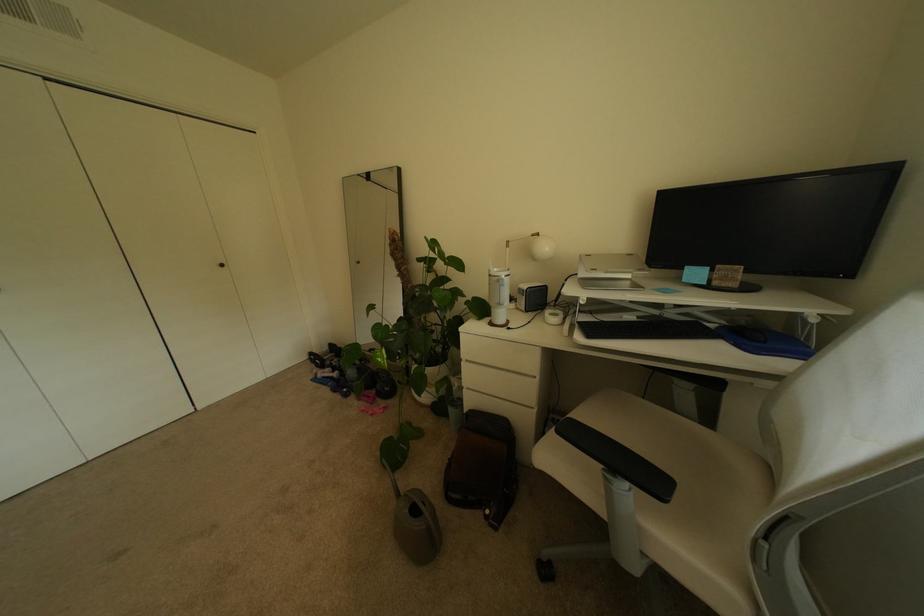
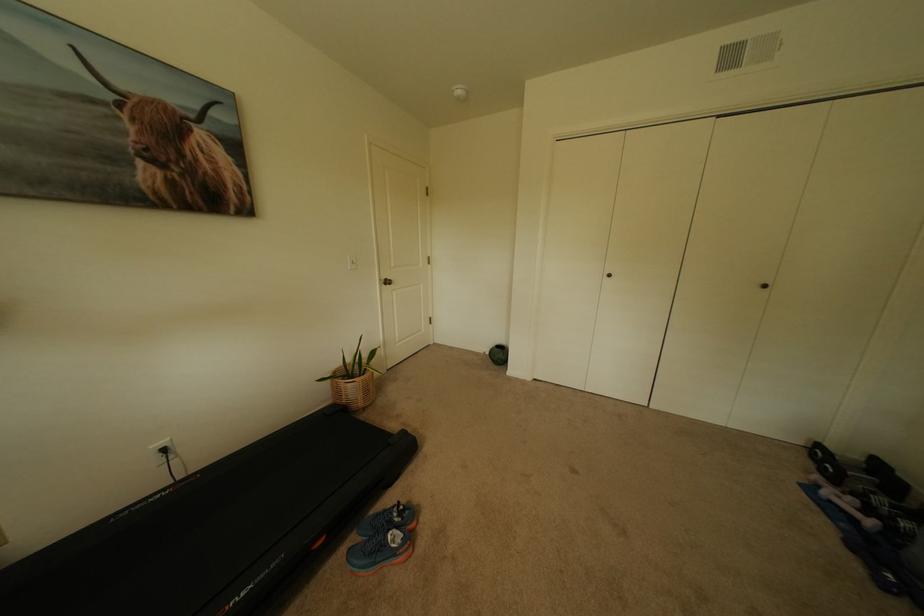
First-person continuous shooting, in which direction is the camera rotating?

The camera rotated toward left-down.